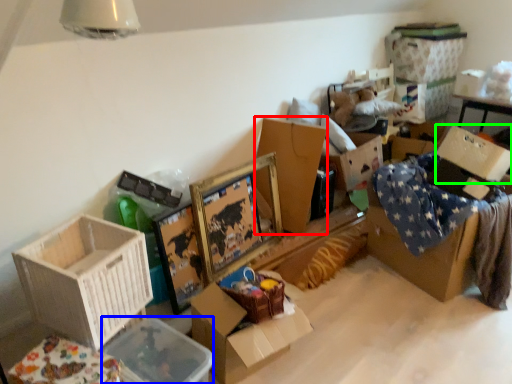
Question: Which object is the farthest from box (highlighted by a red box)? Choose among these: storage box (highlighted by a blue box) or cardboard box (highlighted by a green box).

Choices:
 (A) storage box
 (B) cardboard box

Answer: (A)